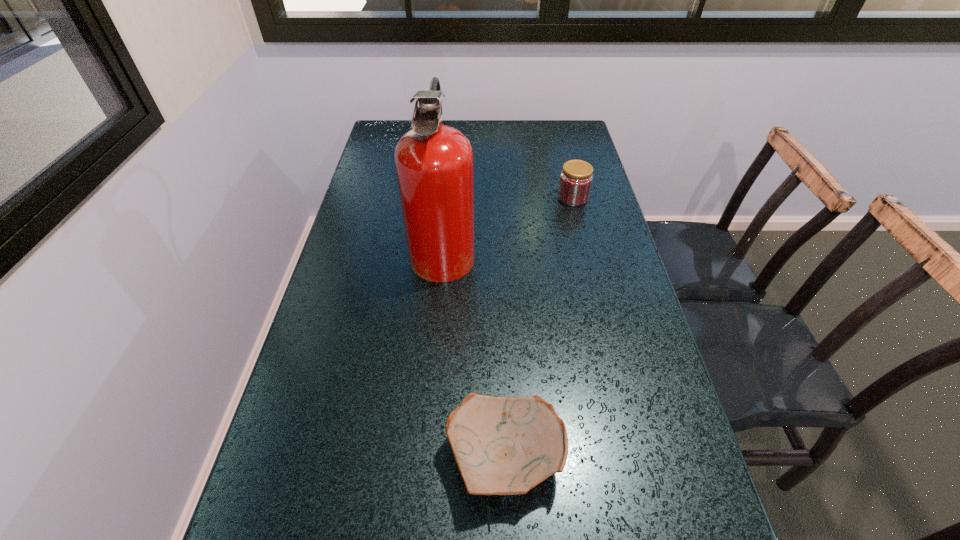
This screenshot has width=960, height=540. Identify the location of vacant area in the image that satisfies the following two spatial constraints: 1. with the handle and nozzle on the nearest object; 2. on the left side of the fire extinguisher. pos(425,457).

I want to click on vacant space that satisfies the following two spatial constraints: 1. on the back side of the nearest object; 2. with the handle and nozzle on the tallest object, so click(496, 249).

The image size is (960, 540). Find the location of `free location that satisfies the following two spatial constraints: 1. with the handle and nozzle on the tallest object; 2. on the back side of the pottery`. free location that satisfies the following two spatial constraints: 1. with the handle and nozzle on the tallest object; 2. on the back side of the pottery is located at coordinates (425, 457).

Locate an element on the screen. free space that satisfies the following two spatial constraints: 1. on the back side of the pottery; 2. with the handle and nozzle on the tallest object is located at coordinates (496, 249).

Identify the location of vacant space that satisfies the following two spatial constraints: 1. on the front side of the jam; 2. with the handle and nozzle on the tallest object. tap(586, 249).